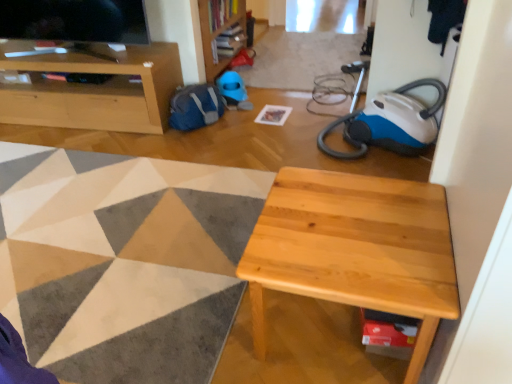
Question: Considering their positions, is white paper at center located in front of or behind wooden bookshelf at upper center?

Choices:
 (A) front
 (B) behind

Answer: (A)

Question: Is point (270, 114) positioned closer to the camera than point (205, 66)?

Choices:
 (A) closer
 (B) farther

Answer: (A)

Question: Which of these objects is positioned farthest from the natural wood table at center?

Choices:
 (A) matte wood cabinet at upper left
 (B) white paper at center
 (C) wooden bookshelf at upper center

Answer: (C)

Question: Which object is positioned farthest from the natural wood table at center?

Choices:
 (A) white paper at center
 (B) wooden bookshelf at upper center
 (C) matte wood cabinet at upper left

Answer: (B)